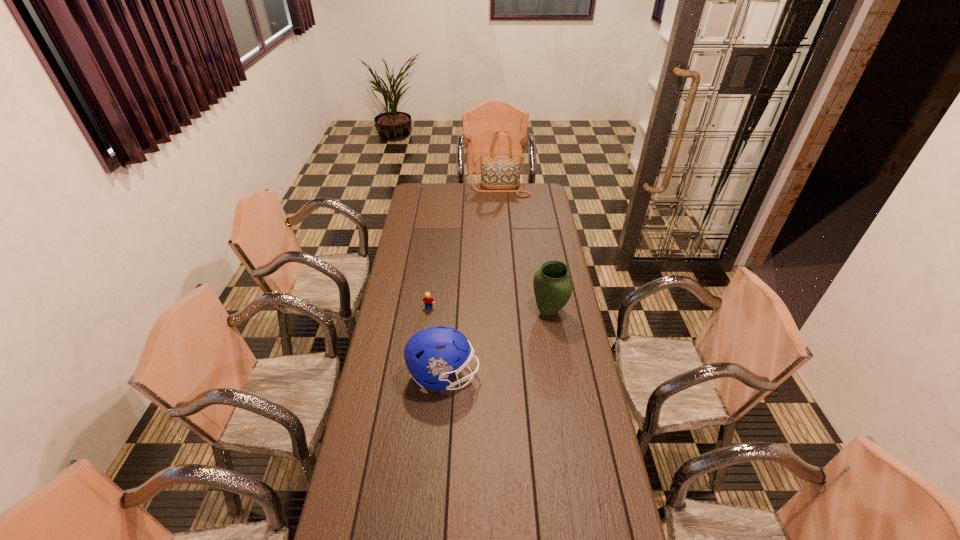
Where is `the tallest object`? the tallest object is located at coordinates (500, 173).

Identify the location of the farthest object. The image size is (960, 540). (500, 173).

I want to click on vase, so click(552, 285).

At what (x,y) coordinates should I click in order to perform the action: click on football helmet. Please return your answer as a coordinate pair (x, y). This screenshot has width=960, height=540. Looking at the image, I should click on (431, 355).

Locate an element on the screen. This screenshot has height=540, width=960. the shortest object is located at coordinates (428, 300).

This screenshot has width=960, height=540. In order to click on vacant area situated on the front-facing side of the farthest object in this screenshot , I will do `click(502, 224)`.

Find the location of a particular element. This screenshot has width=960, height=540. free space located on the back of the vase is located at coordinates (544, 282).

The width and height of the screenshot is (960, 540). What are the coordinates of `free space located on the face guard of the football helmet` in the screenshot? It's located at (548, 375).

Locate an element on the screen. vacant area located 0.210m on the front-facing side of the Lego is located at coordinates (424, 344).

Image resolution: width=960 pixels, height=540 pixels. Identify the location of object that is at the far edge. (500, 173).